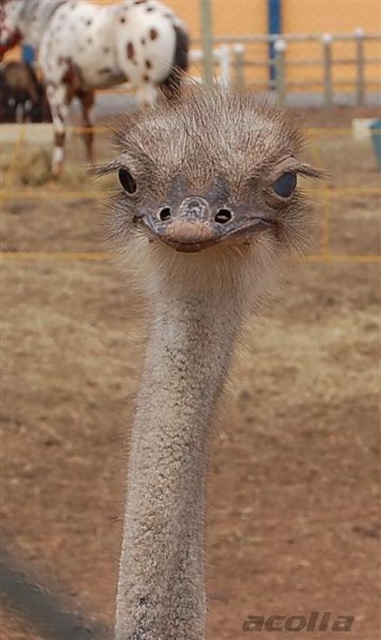
Is gray feathered ostrich at center shorter than gray feathered ostrich head at upper center?

Yes, gray feathered ostrich at center is shorter than gray feathered ostrich head at upper center.

Can you confirm if gray feathered ostrich at center is thinner than gray feathered ostrich head at upper center?

Indeed, gray feathered ostrich at center has a lesser width compared to gray feathered ostrich head at upper center.

At what (x,y) coordinates should I click in order to perform the action: click on gray feathered ostrich at center. Please return your answer as a coordinate pair (x, y). Looking at the image, I should click on (190, 320).

This screenshot has height=640, width=381. I want to click on gray feathered ostrich at center, so click(190, 320).